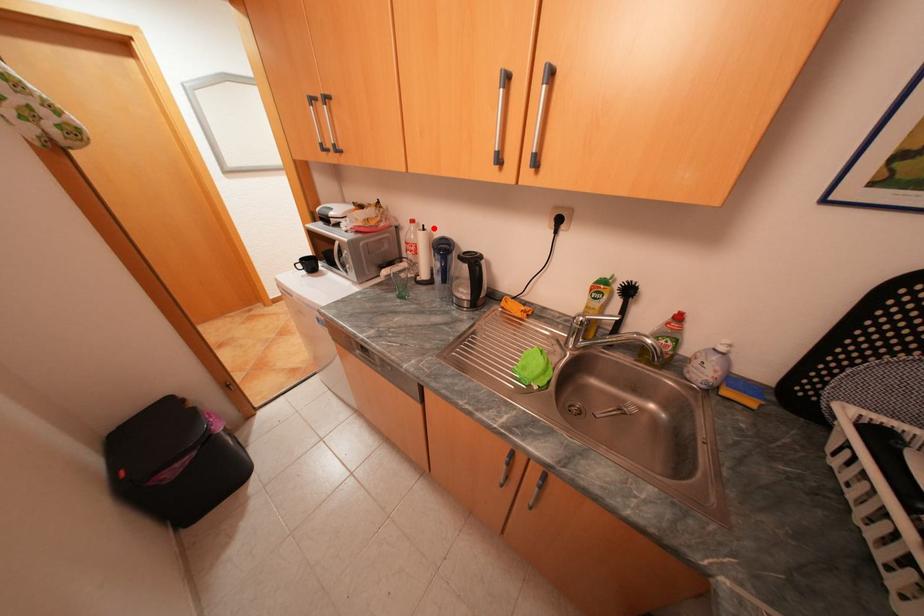
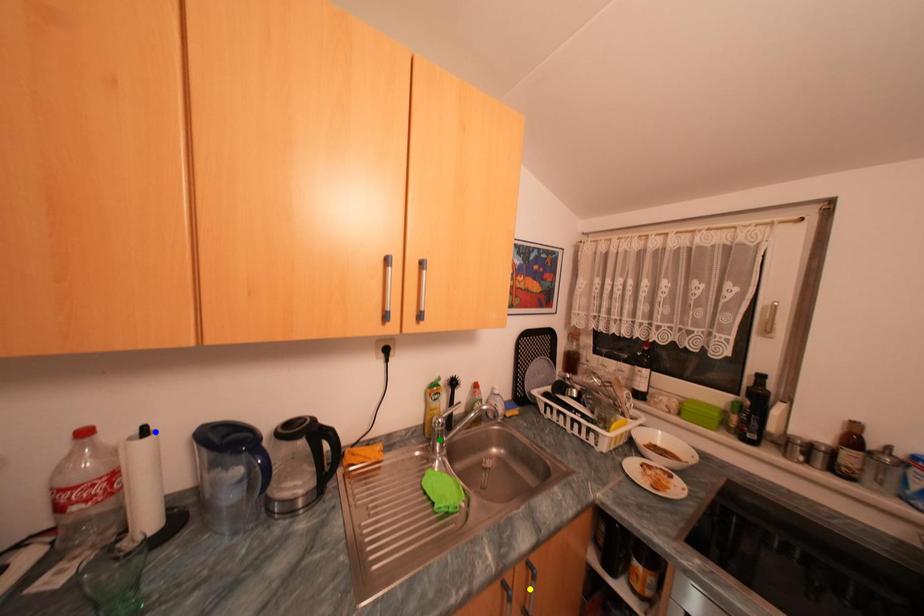
Question: I am providing you with two images of the same scene from different viewpoints. A red point is marked on the first image. You are given multiple points on the second image. Which point in image 2 is actually the same real-world point as the red point in image 1?

Choices:
 (A) green point
 (B) yellow point
 (C) blue point

Answer: (C)